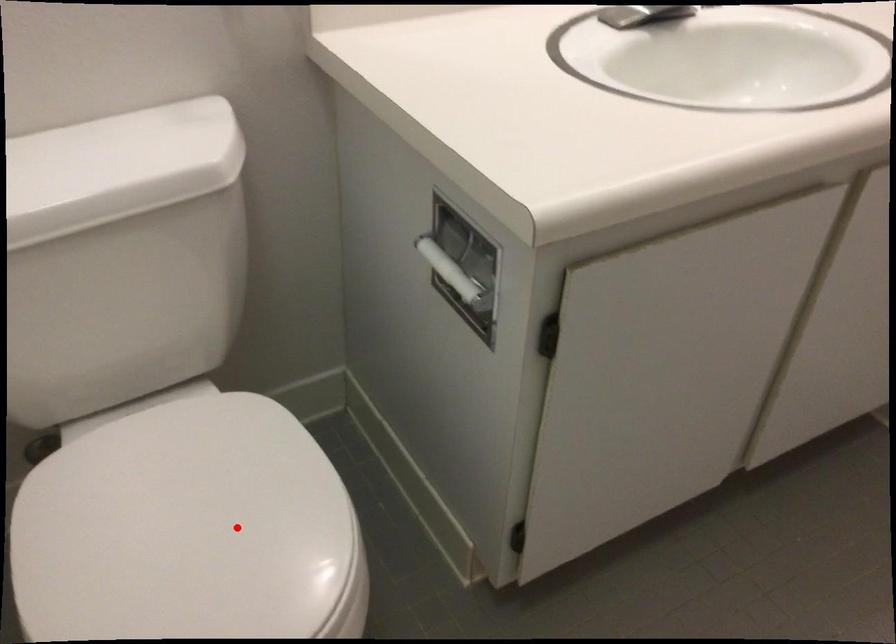
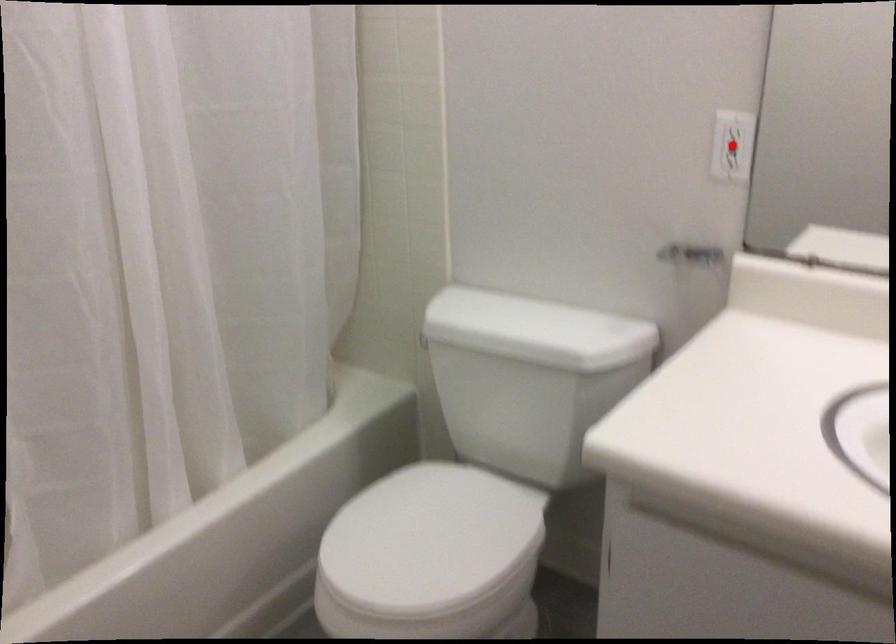
I am providing you with two images of the same scene from different viewpoints. A red point is marked on the first image and another point is marked on the second image. Is the marked point in image1 the same physical position as the marked point in image2?

No